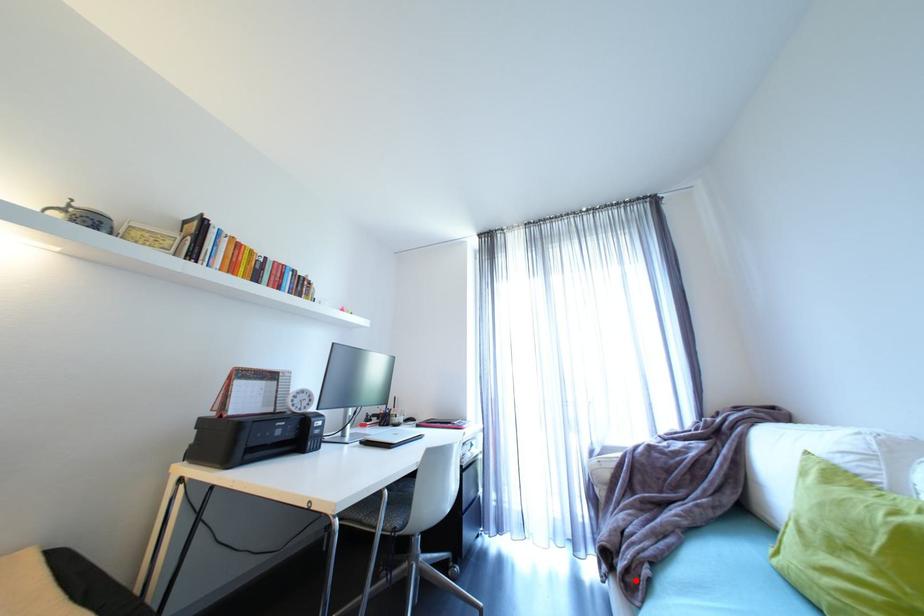
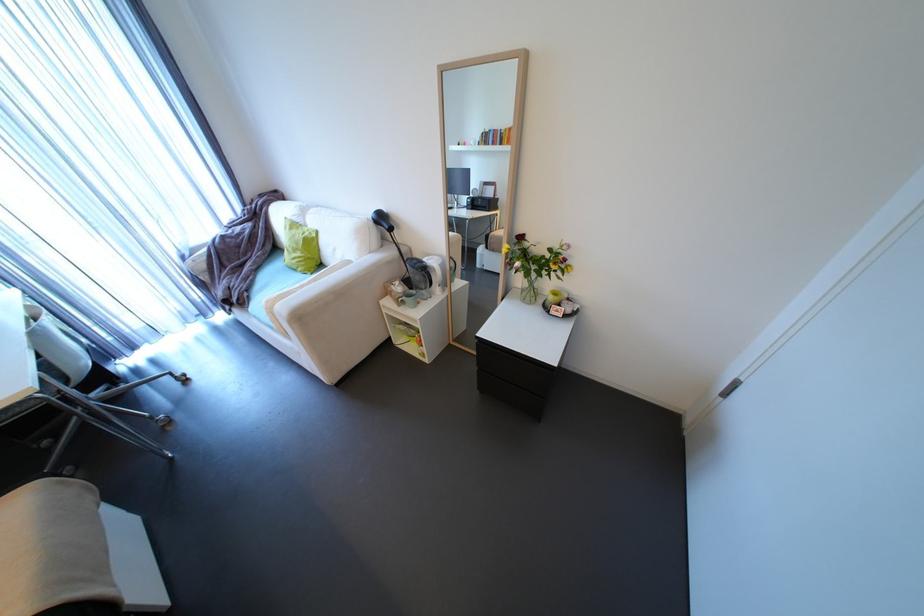
In the second image, find the point that corresponds to the highlighted location in the first image.

(248, 302)